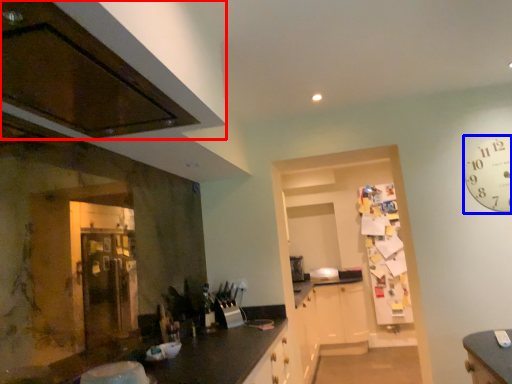
Question: Which object is closer to the camera taking this photo, cabinetry (highlighted by a red box) or clock (highlighted by a blue box)?

Choices:
 (A) cabinetry
 (B) clock

Answer: (A)